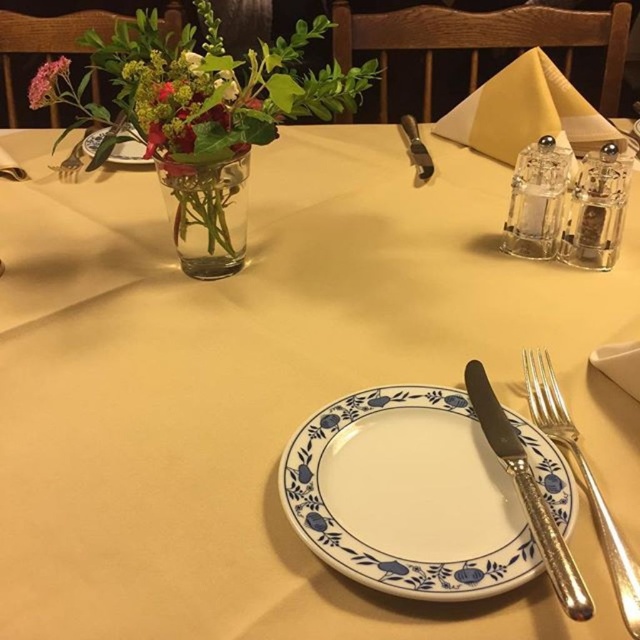
What do you see at coordinates (205, 212) in the screenshot?
I see `clear glass vase at upper left` at bounding box center [205, 212].

In the scene shown: Which of these two, clear glass vase at upper left or pink matte flower at upper left, stands taller?

pink matte flower at upper left is taller.

Identify the location of clear glass vase at upper left. This screenshot has width=640, height=640. (205, 212).

Image resolution: width=640 pixels, height=640 pixels. I want to click on clear glass vase at upper left, so click(205, 212).

Can you confirm if silver metallic fork at right is positioned below white porcelain plate at upper center?

Yes, silver metallic fork at right is below white porcelain plate at upper center.

Which of these two, silver metallic fork at right or white porcelain plate at upper center, stands shorter?

silver metallic fork at right

The width and height of the screenshot is (640, 640). What do you see at coordinates (582, 481) in the screenshot?
I see `silver metallic fork at right` at bounding box center [582, 481].

Locate an element on the screen. silver metallic fork at right is located at coordinates (582, 481).

Who is higher up, translucent glass vase at upper left or silver plated knife at right?

translucent glass vase at upper left

Who is positioned more to the right, translucent glass vase at upper left or silver plated knife at right?

silver plated knife at right is more to the right.

Which is behind, point (58, 140) or point (563, 570)?

Point (58, 140)

Where is `translucent glass vase at upper left`? Image resolution: width=640 pixels, height=640 pixels. translucent glass vase at upper left is located at coordinates (205, 90).